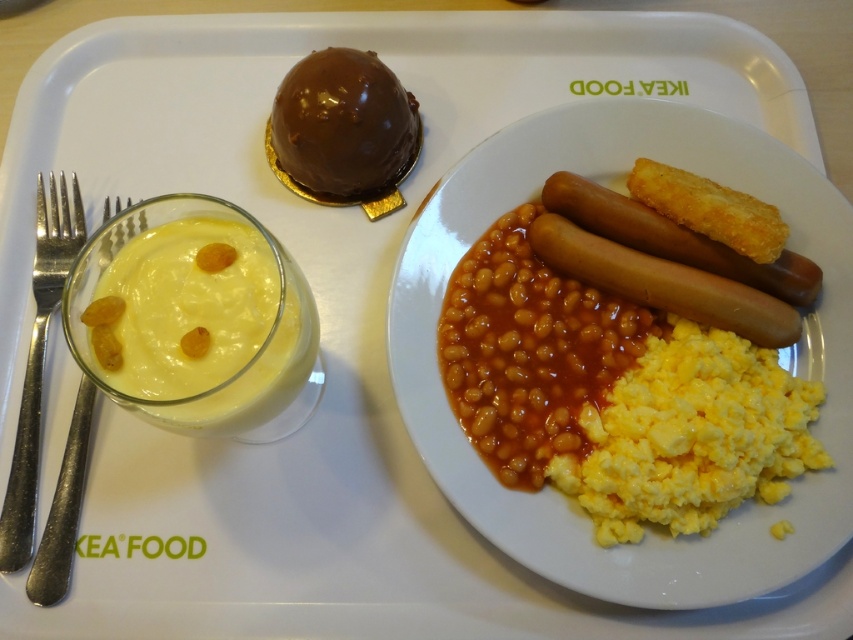
Based on the photo, you are a food critic examining the meal on the white IKEA Food tray. You notice two sets of silverware near the creamy dessert bowl. Which one is positioned higher up, the silver metallic fork at left or the silvermetallicforks at left?

The silver metallic fork at left is located above the silvermetallicforks at left, so the silver metallic fork at left is positioned higher up.